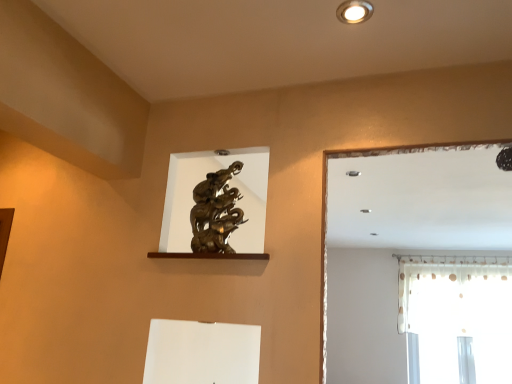
Question: Is white sheer curtain at right at the back of matte white recessed light at upper center?

Choices:
 (A) yes
 (B) no

Answer: (B)

Question: From a real-world perspective, is matte white recessed light at upper center positioned over white sheer curtain at right based on gravity?

Choices:
 (A) no
 (B) yes

Answer: (B)

Question: From the image's perspective, is matte white recessed light at upper center under white sheer curtain at right?

Choices:
 (A) yes
 (B) no

Answer: (B)

Question: Is matte white recessed light at upper center wider than white sheer curtain at right?

Choices:
 (A) no
 (B) yes

Answer: (A)

Question: Considering the relative sizes of matte white recessed light at upper center and white sheer curtain at right in the image provided, is matte white recessed light at upper center bigger than white sheer curtain at right?

Choices:
 (A) no
 (B) yes

Answer: (A)

Question: Is matte white recessed light at upper center oriented towards white sheer curtain at right?

Choices:
 (A) no
 (B) yes

Answer: (A)

Question: Does white sheer curtain at right turn towards matte white recessed light at upper center?

Choices:
 (A) no
 (B) yes

Answer: (B)

Question: Does white sheer curtain at right have a greater height compared to matte white recessed light at upper center?

Choices:
 (A) yes
 (B) no

Answer: (A)

Question: Is white sheer curtain at right at the left side of matte white recessed light at upper center?

Choices:
 (A) no
 (B) yes

Answer: (A)

Question: Can you confirm if white sheer curtain at right is positioned to the right of matte white recessed light at upper center?

Choices:
 (A) no
 (B) yes

Answer: (B)

Question: From the image's perspective, would you say white sheer curtain at right is shown under matte white recessed light at upper center?

Choices:
 (A) yes
 (B) no

Answer: (A)

Question: Does white sheer curtain at right have a larger size compared to matte white recessed light at upper center?

Choices:
 (A) no
 (B) yes

Answer: (B)

Question: Based on their sizes in the image, would you say white sheer curtain at right is bigger or smaller than matte white recessed light at upper center?

Choices:
 (A) small
 (B) big

Answer: (B)